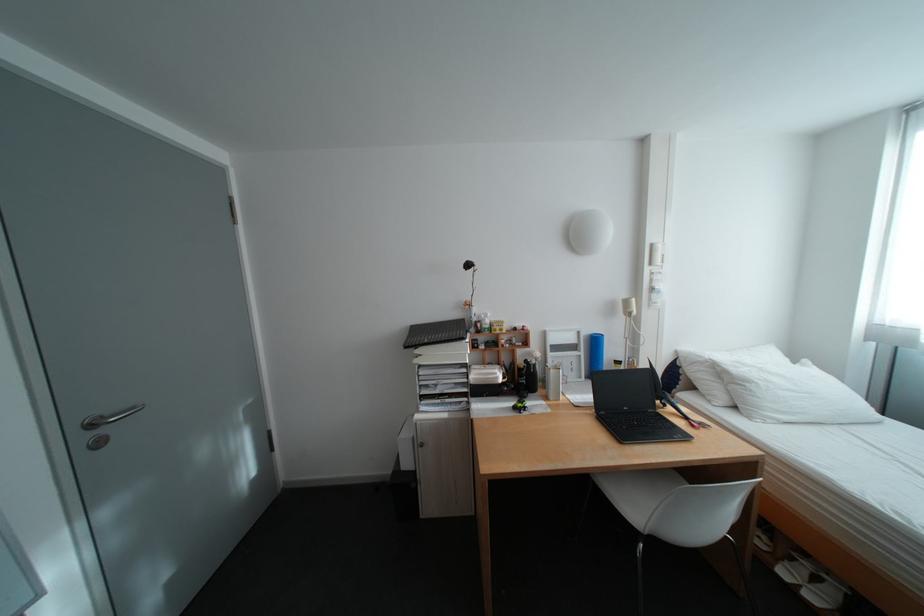
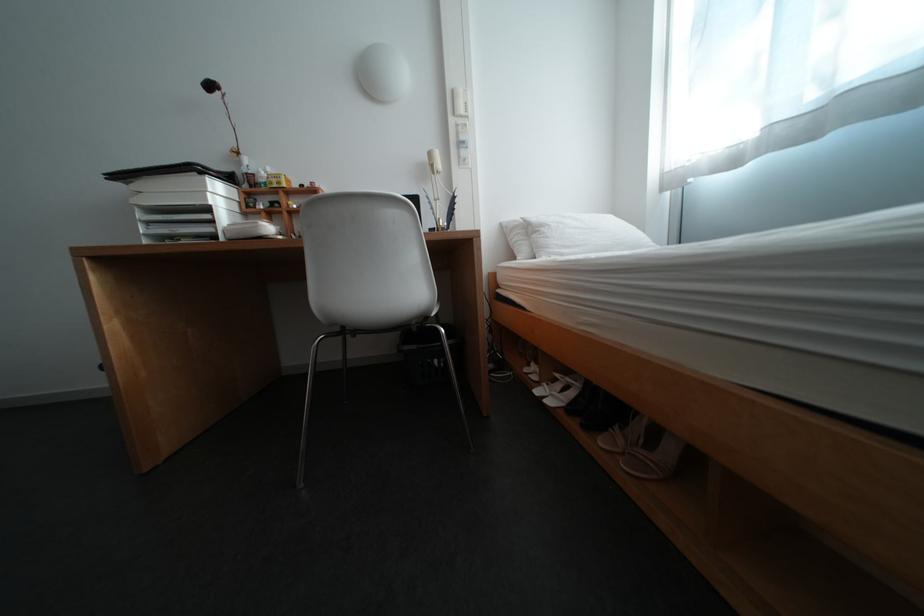
The point at (x=508, y=375) is marked in the first image. Where is the corresponding point in the second image?

(270, 224)